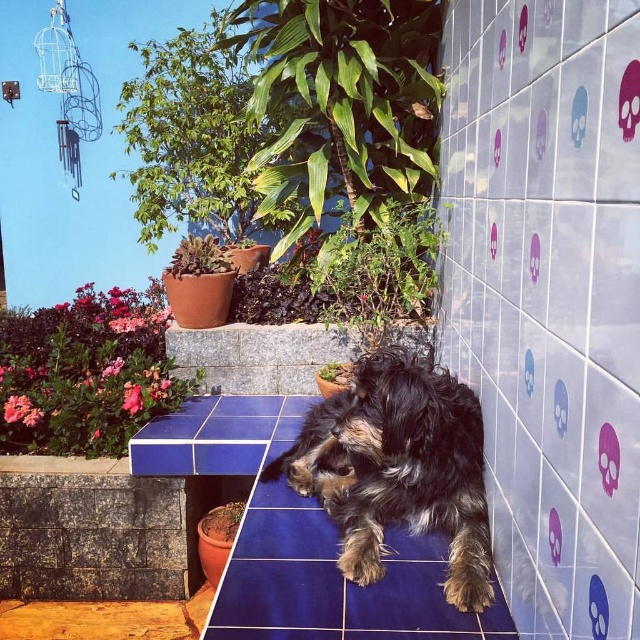
Can you confirm if white glossy tile at center right is thinner than fuzzy brown dog at center?

Yes, white glossy tile at center right is thinner than fuzzy brown dog at center.

I want to click on white glossy tile at center right, so (x=548, y=296).

Who is more forward, (x=540, y=340) or (x=400, y=445)?

Positioned in front is point (x=540, y=340).

Identify the location of white glossy tile at center right. (548, 296).